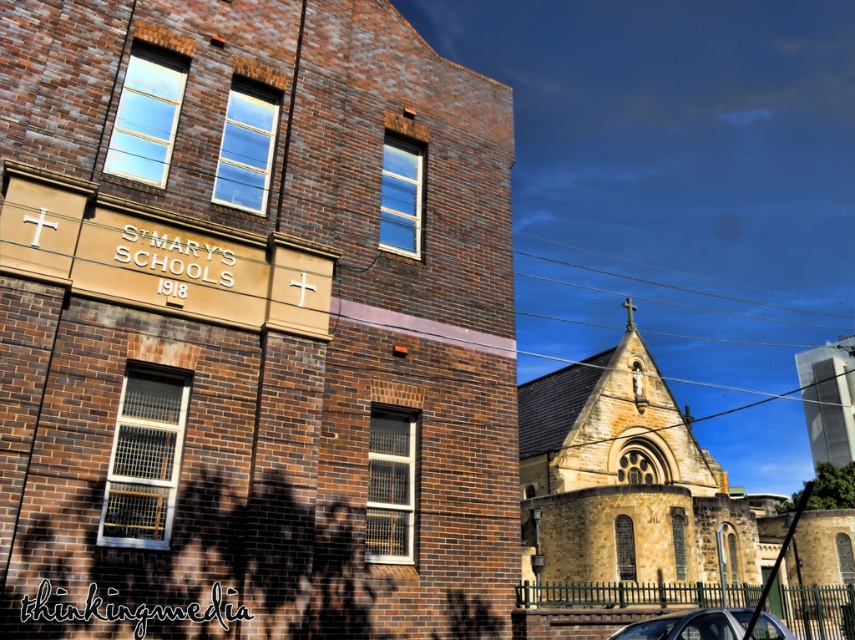
Question: Which object is the farthest from the brown stone church at center?

Choices:
 (A) metallic silver car at lower right
 (B) yellow stone church at center

Answer: (B)

Question: Which object appears closest to the camera in this image?

Choices:
 (A) yellow stone church at center
 (B) brown stone church at center
 (C) metallic silver car at lower right

Answer: (B)

Question: Which of the following is the closest to the observer?

Choices:
 (A) brown stone church at center
 (B) metallic silver car at lower right

Answer: (A)

Question: Does brown stone church at center have a larger size compared to yellow stone church at center?

Choices:
 (A) no
 (B) yes

Answer: (A)

Question: Is brown stone church at center positioned behind yellow stone church at center?

Choices:
 (A) yes
 (B) no

Answer: (B)

Question: Does brown stone church at center appear under yellow stone church at center?

Choices:
 (A) yes
 (B) no

Answer: (B)